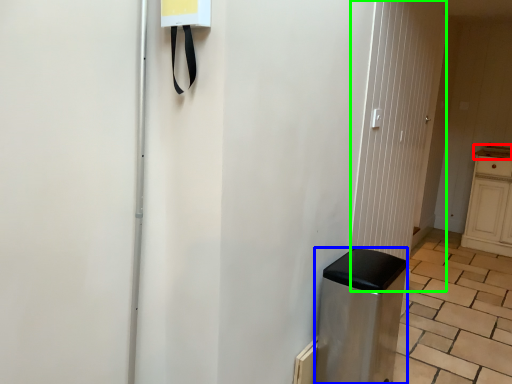
Question: Based on their relative distances, which object is farther from counter top (highlighted by a red box)? Choose from appliance (highlighted by a blue box) and screen door (highlighted by a green box).

Choices:
 (A) appliance
 (B) screen door

Answer: (A)